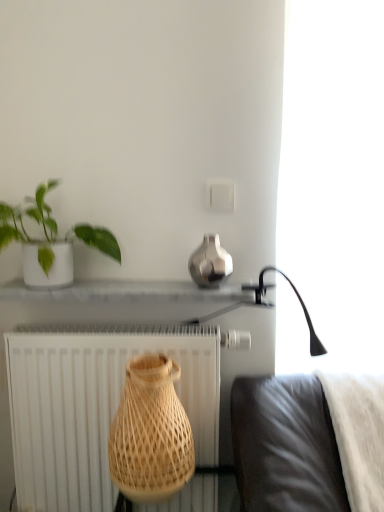
You are a GUI agent. You are given a task and a screenshot of the screen. Output one action in this format:
    pyautogui.click(x=<x>, y=<y>)
    Task: Click on the vacant space to the left of shiny metallic vase at center, positioned as the 2th vase in left-to-right order
    The height and width of the screenshot is (512, 384).
    Given the screenshot: What is the action you would take?
    pyautogui.click(x=144, y=283)